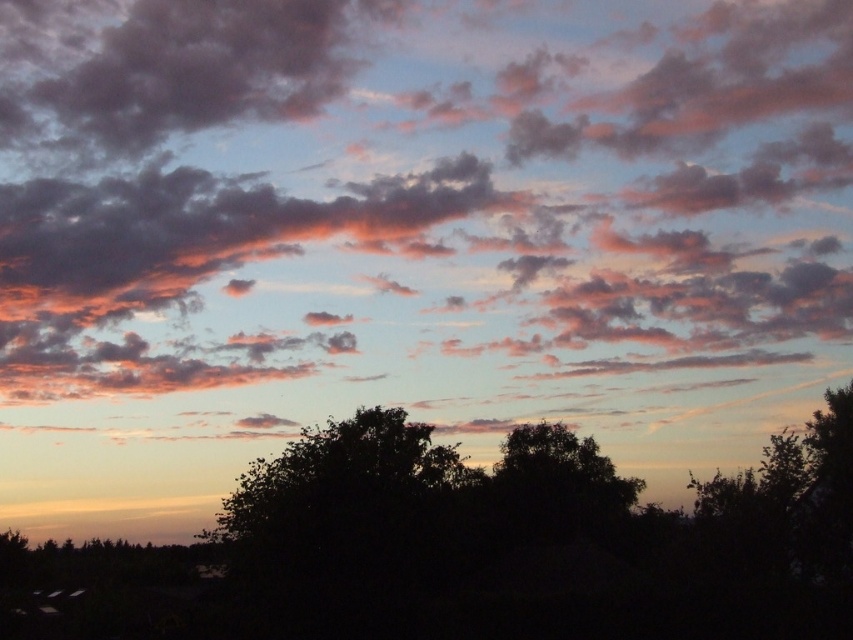
You are standing in the middle of a field looking at the cloudy sky at upper center and the green leafy tree at center. Which object is closer to you?

The cloudy sky at upper center is further to the viewer than the green leafy tree at center, so the green leafy tree at center is closer to you.

You are an astronomer analyzing the sunset image. You need to locate the cloudy sky at upper center. What are its coordinates?

The cloudy sky at upper center is located at coordinates point (x=416, y=208).

You are an astronomer observing the sunset and notice two points in the sky marked as point (337, 54) and point (535, 477). Which point is closer to your observation position?

Point (337, 54) is further to the viewer than point (535, 477), so the closer point to your observation position is point (535, 477).